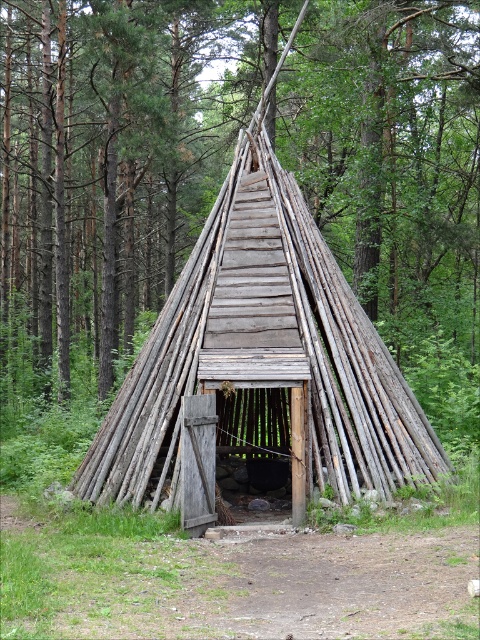
Question: Does wooden hut at center have a larger size compared to weathered wood hut at center?

Choices:
 (A) yes
 (B) no

Answer: (A)

Question: Can you confirm if wooden hut at center is positioned above weathered wood hut at center?

Choices:
 (A) no
 (B) yes

Answer: (B)

Question: Is wooden hut at center smaller than weathered wood hut at center?

Choices:
 (A) yes
 (B) no

Answer: (B)

Question: Which object appears closest to the camera in this image?

Choices:
 (A) weathered wood hut at center
 (B) wooden hut at center

Answer: (A)

Question: Which object is closer to the camera taking this photo?

Choices:
 (A) weathered wood hut at center
 (B) wooden hut at center

Answer: (A)

Question: Which of the following is the closest to the observer?

Choices:
 (A) weathered wood hut at center
 (B) wooden hut at center

Answer: (A)